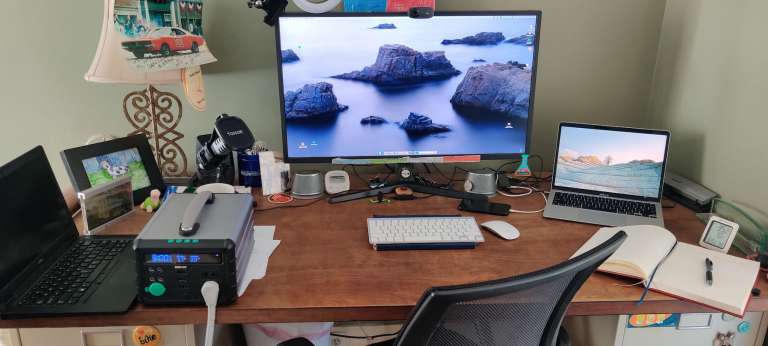
Image resolution: width=768 pixels, height=346 pixels. What are the coordinates of `wooden finish desk` in the screenshot? It's located at (316, 250).